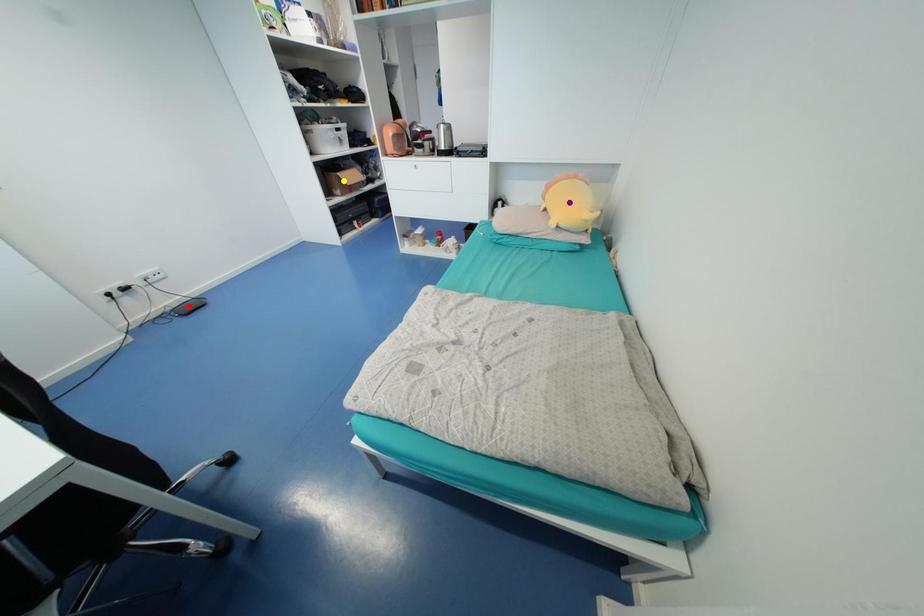
Order these from nearest to farthest:
purple point | yellow point | red point

purple point < red point < yellow point